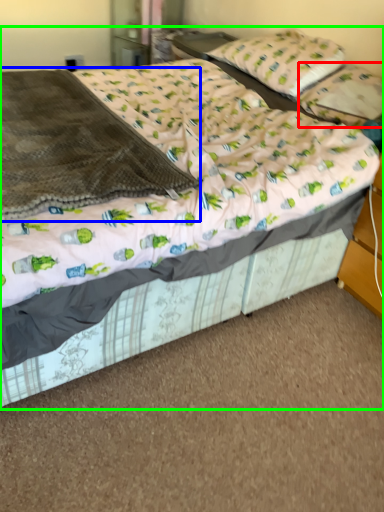
Question: Estimate the real-world distances between objects in this image. Which object is closer to pillow (highlighted by a red box), blanket (highlighted by a blue box) or bed (highlighted by a green box)?

Choices:
 (A) blanket
 (B) bed

Answer: (B)